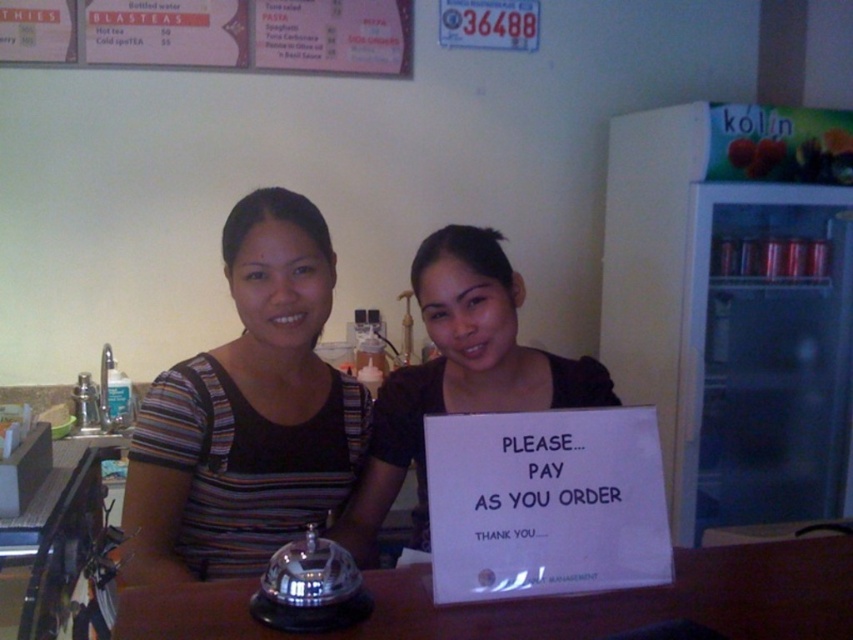
Between striped fabric shirt at center and matte brown shirt at center, which one is positioned higher?

striped fabric shirt at center

Who is lower down, striped fabric shirt at center or matte brown shirt at center?

matte brown shirt at center is below.

Locate an element on the screen. striped fabric shirt at center is located at coordinates (247, 413).

This screenshot has height=640, width=853. What are the coordinates of `striped fabric shirt at center` in the screenshot? It's located at (247, 413).

Does brown wooden table at center have a lesser width compared to pink paper menu at upper center?

Indeed, brown wooden table at center has a lesser width compared to pink paper menu at upper center.

Does brown wooden table at center appear on the right side of pink paper menu at upper center?

Yes, brown wooden table at center is to the right of pink paper menu at upper center.

Is point (120, 634) positioned after point (384, 42)?

No, it is in front of (384, 42).

Image resolution: width=853 pixels, height=640 pixels. Identify the location of brown wooden table at center. (550, 602).

Measure the distance from matte brown shirt at center to pink paper menu at upper center.

matte brown shirt at center and pink paper menu at upper center are 5.41 feet apart.

Based on the photo, is matte brown shirt at center to the right of pink paper menu at upper center from the viewer's perspective?

Indeed, matte brown shirt at center is positioned on the right side of pink paper menu at upper center.

Consider the image. Who is more distant from viewer, (412,416) or (9,33)?

Point (9,33)

At what (x,y) coordinates should I click in order to perform the action: click on matte brown shirt at center. Please return your answer as a coordinate pair (x, y). The width and height of the screenshot is (853, 640). Looking at the image, I should click on (457, 374).